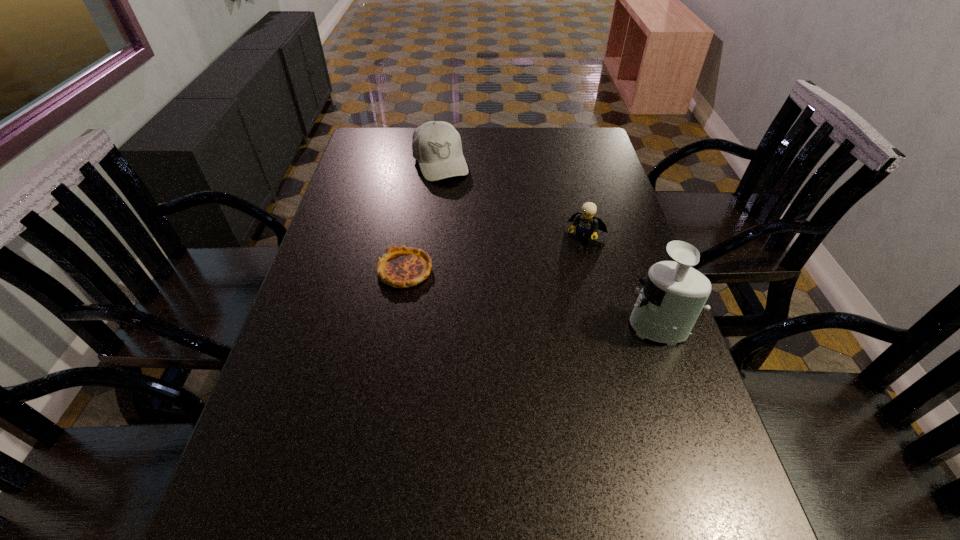
Where is `quiche`? Image resolution: width=960 pixels, height=540 pixels. quiche is located at coordinates (401, 267).

This screenshot has height=540, width=960. What are the coordinates of `the third farthest object` in the screenshot? It's located at (401, 267).

At what (x,y) coordinates should I click in order to perform the action: click on the nearest object. Please return your answer as a coordinate pair (x, y). Image resolution: width=960 pixels, height=540 pixels. Looking at the image, I should click on (674, 294).

This screenshot has width=960, height=540. Find the location of `juicer`. juicer is located at coordinates [674, 294].

Find the location of a particular element. This screenshot has height=540, width=960. baseball cap is located at coordinates (436, 145).

The height and width of the screenshot is (540, 960). I want to click on the second farthest object, so click(x=586, y=223).

I want to click on vacant space located on the back of the third farthest object, so click(418, 196).

Identify the location of vacant area situated on the back of the tallest object. This screenshot has height=540, width=960. (643, 291).

You are a GUI agent. You are given a task and a screenshot of the screen. Output one action in this format:
    pyautogui.click(x=<x>, y=<y>)
    Task: Click on the blank area located on the front-facing side of the baseball cap
    This screenshot has width=960, height=540.
    Given the screenshot: What is the action you would take?
    (x=453, y=194)

The image size is (960, 540). I want to click on free space located on the front-facing side of the baseball cap, so click(x=456, y=200).